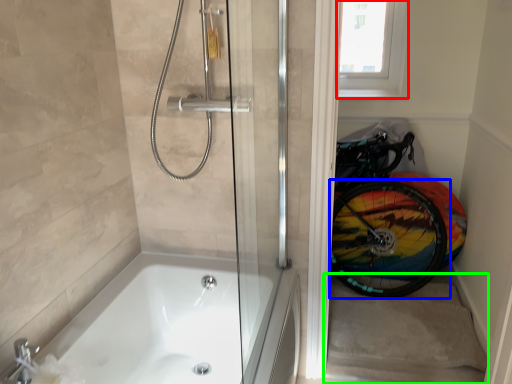
Question: Estimate the real-world distances between objects in this image. Which object is closer to window screen (highlighted by a red box), bicycle wheel (highlighted by a blue box) or stairwell (highlighted by a green box)?

Choices:
 (A) bicycle wheel
 (B) stairwell

Answer: (A)